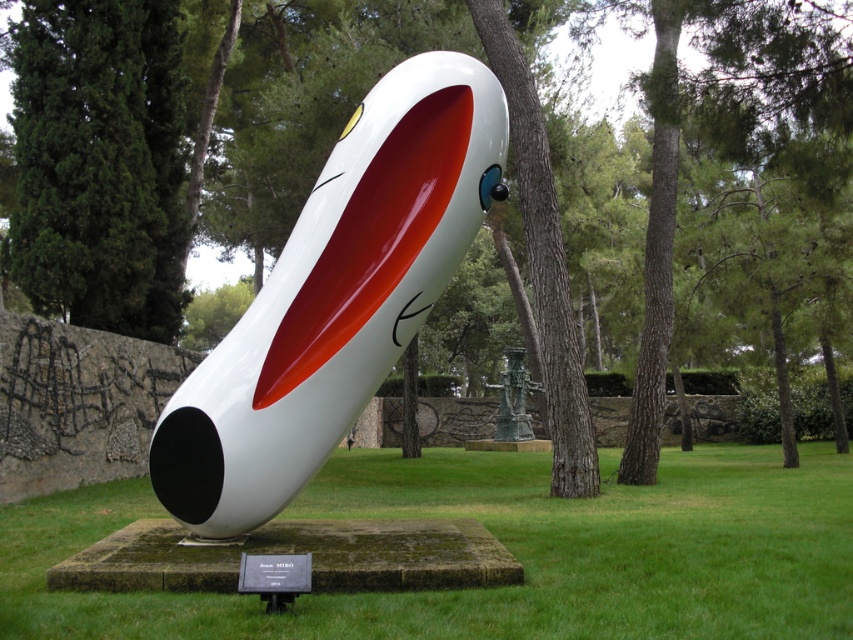
Question: Which point appears farthest from the camera in this image?

Choices:
 (A) (392, 348)
 (B) (817, 605)

Answer: (A)

Question: Can you confirm if green grass at center is positioned to the left of white glossy rocket at center?

Choices:
 (A) yes
 (B) no

Answer: (B)

Question: Considering the relative positions of green grass at center and green patinated metal statue at center in the image provided, where is green grass at center located with respect to green patinated metal statue at center?

Choices:
 (A) above
 (B) below

Answer: (B)

Question: Based on their relative distances, which object is farther from the green patinated metal statue at center?

Choices:
 (A) green grass at center
 (B) white glossy rocket at center

Answer: (B)

Question: Does green grass at center have a larger size compared to white glossy rocket at center?

Choices:
 (A) yes
 (B) no

Answer: (A)

Question: Which object appears closest to the camera in this image?

Choices:
 (A) white glossy rocket at center
 (B) green patinated metal statue at center

Answer: (A)